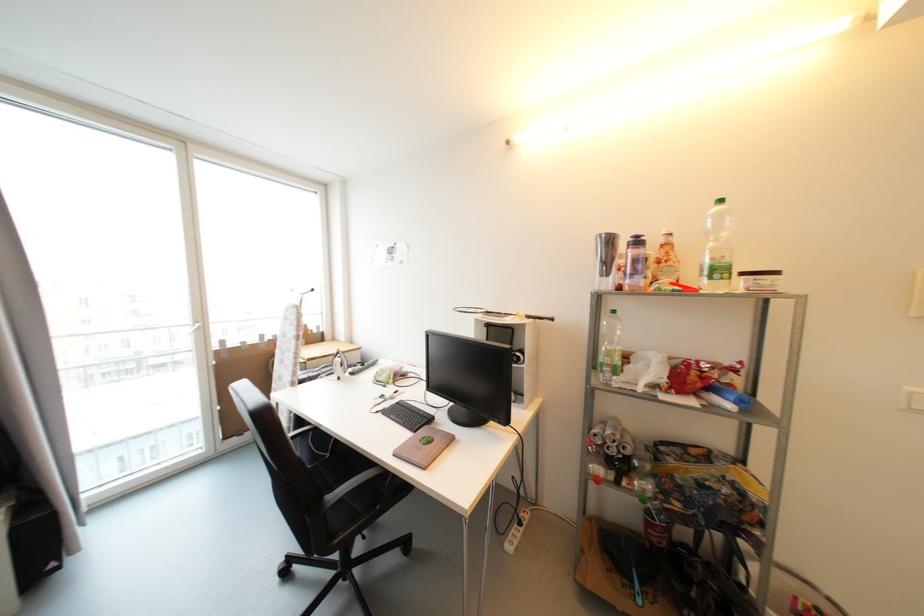
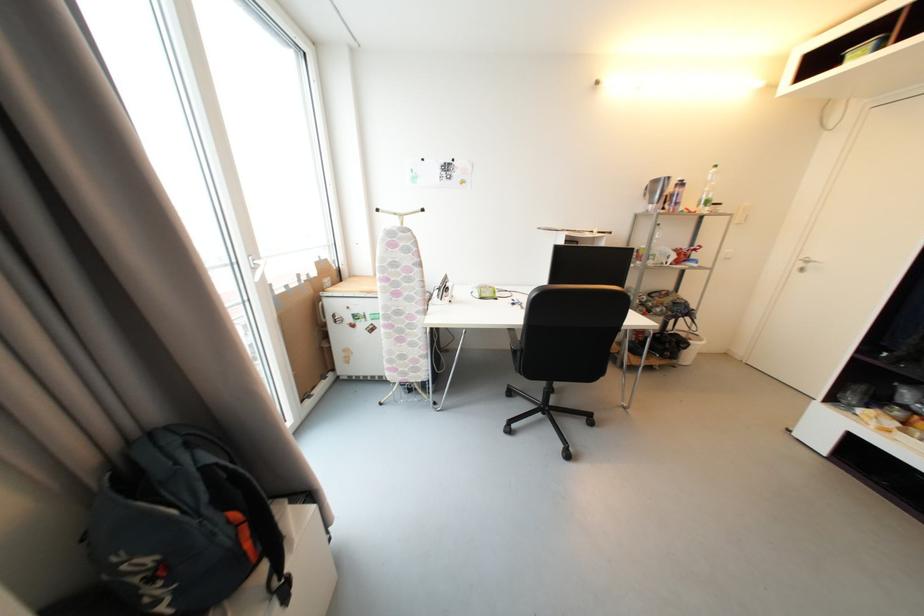
The point at (x=630, y=254) is marked in the first image. Where is the corresponding point in the second image?

(674, 192)